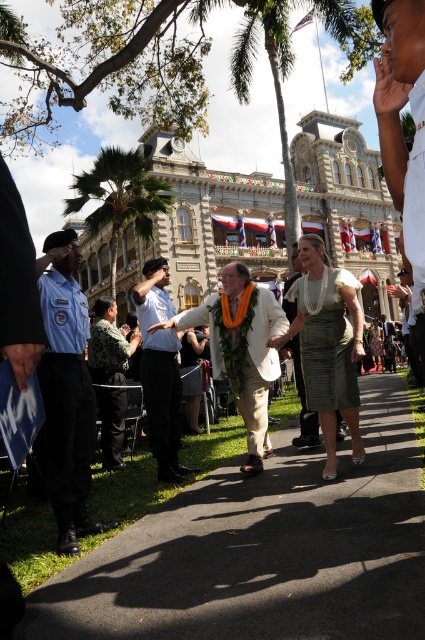
Question: Can you confirm if light blue uniform at left is positioned to the right of white uniform at upper center?

Choices:
 (A) no
 (B) yes

Answer: (A)

Question: Can you confirm if white shirt at center is positioned to the left of satin gold dress at center?

Choices:
 (A) no
 (B) yes

Answer: (A)

Question: Which of these objects is positioned closest to the white uniform at upper center?

Choices:
 (A) black asphalt pavement at center
 (B) white textured suit at center

Answer: (B)

Question: Which object is closer to the camera taking this photo?

Choices:
 (A) light blue uniform at left
 (B) white shirt at center
 (C) matte black dress at center
 (D) white uniform at center

Answer: (B)

Question: Does light blue uniform at left come in front of white textured suit at center?

Choices:
 (A) no
 (B) yes

Answer: (B)

Question: Which point is farther to the camera?

Choices:
 (A) (159, 424)
 (B) (413, 93)
 (C) (45, 470)
 (D) (407, 10)

Answer: (A)